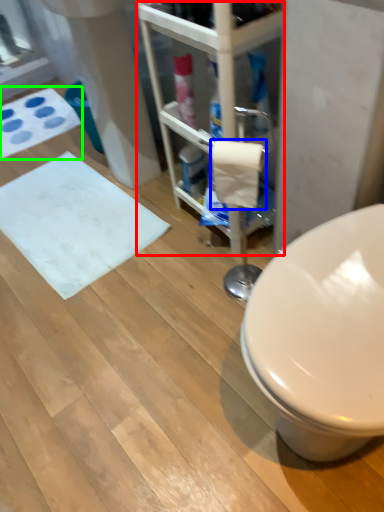
Question: Considering the real-world distances, which object is farthest from shelf (highlighted by a red box)? toilet paper (highlighted by a blue box) or bath mat (highlighted by a green box)?

Choices:
 (A) toilet paper
 (B) bath mat

Answer: (B)